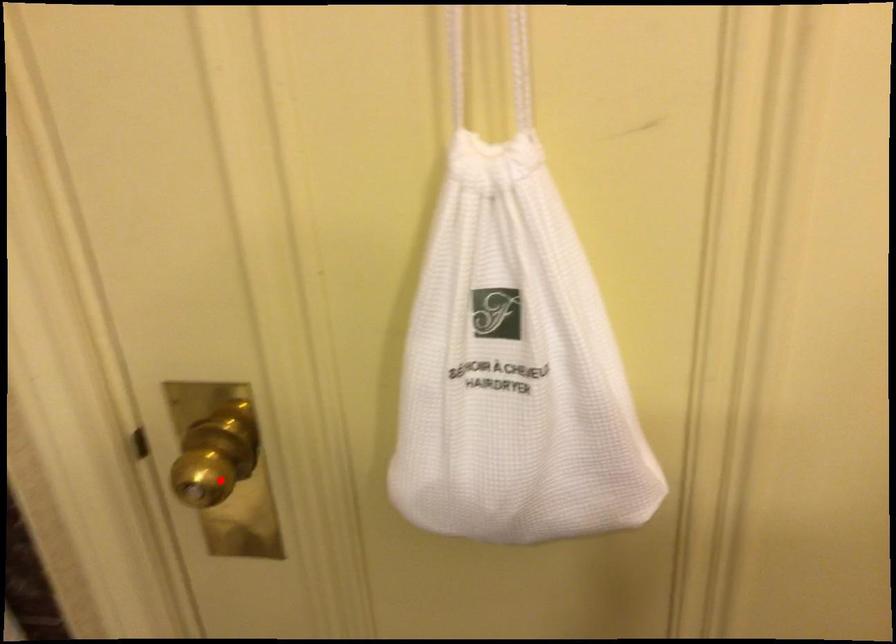
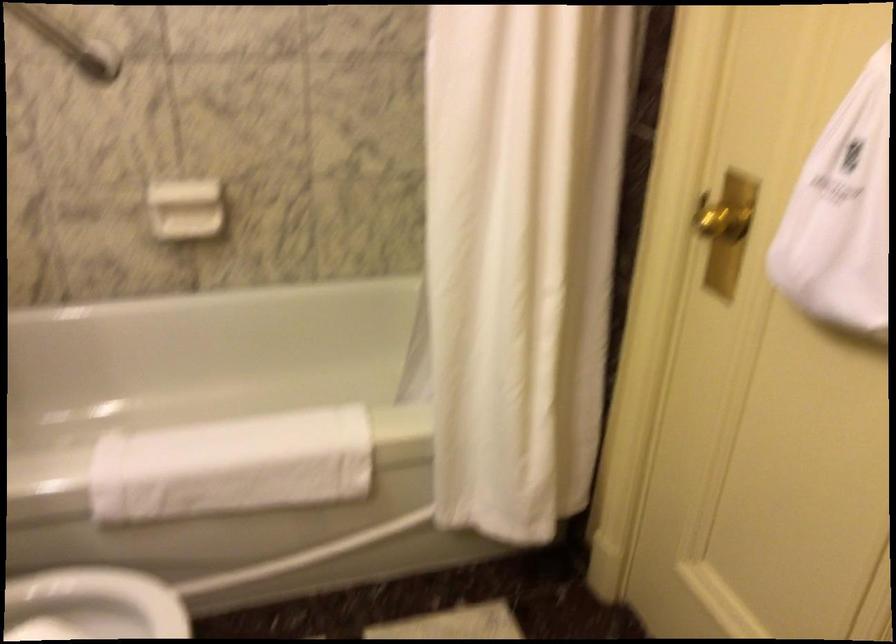
The point at the highlighted location is marked in the first image. Where is the corresponding point in the second image?

(722, 222)